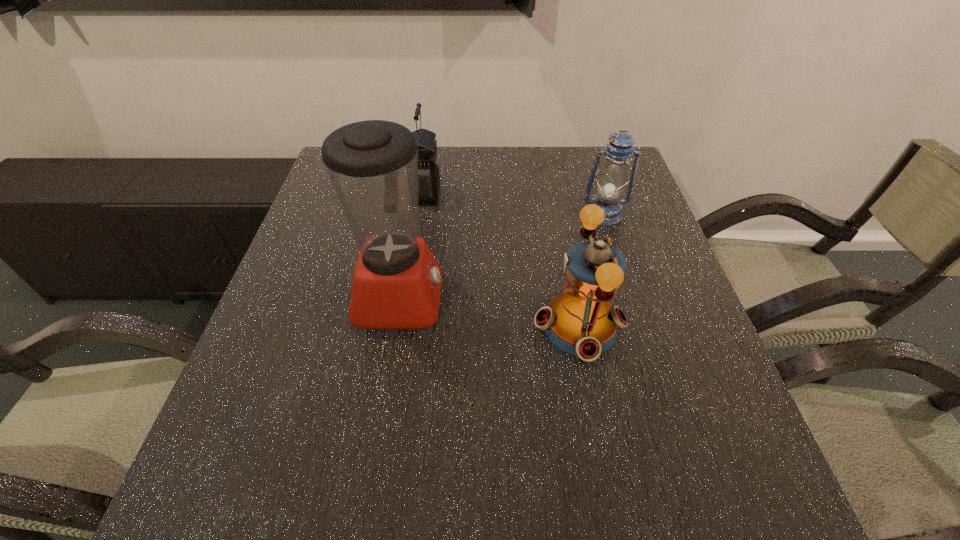
Where is `vacant space at the near edge`? This screenshot has width=960, height=540. vacant space at the near edge is located at coordinates (337, 528).

What are the coordinates of `vacant area at the left edge` in the screenshot? It's located at (277, 327).

The width and height of the screenshot is (960, 540). Find the location of `free location at the right edge`. free location at the right edge is located at coordinates (670, 280).

What are the coordinates of `blank space at the near left corner of the desktop` in the screenshot? It's located at (217, 470).

At what (x,y) coordinates should I click in order to perform the action: click on vacant space that is in between the nearest lantern and the tallest object. Please return your answer as a coordinate pair (x, y). This screenshot has width=960, height=540. Looking at the image, I should click on (490, 312).

Locate an element on the screen. free space between the nearest lantern and the blender is located at coordinates (490, 312).

This screenshot has width=960, height=540. Identify the location of object that can be found as the closest to the nearest lantern. (373, 165).

Select which object is the third closest to the tallest object. Please provide its 2D coordinates. Your answer should be formatted as a tuple, i.e. [(x, y)], where the tuple contains the x and y coordinates of a point satisfying the conditions above.

[(611, 182)]

Choose which lantern is the third nearest neighbor to the tallest object. Please provide its 2D coordinates. Your answer should be formatted as a tuple, i.e. [(x, y)], where the tuple contains the x and y coordinates of a point satisfying the conditions above.

[(611, 182)]

Point out which lantern is positioned as the nearest to the nearest lantern. Please provide its 2D coordinates. Your answer should be formatted as a tuple, i.e. [(x, y)], where the tuple contains the x and y coordinates of a point satisfying the conditions above.

[(611, 182)]